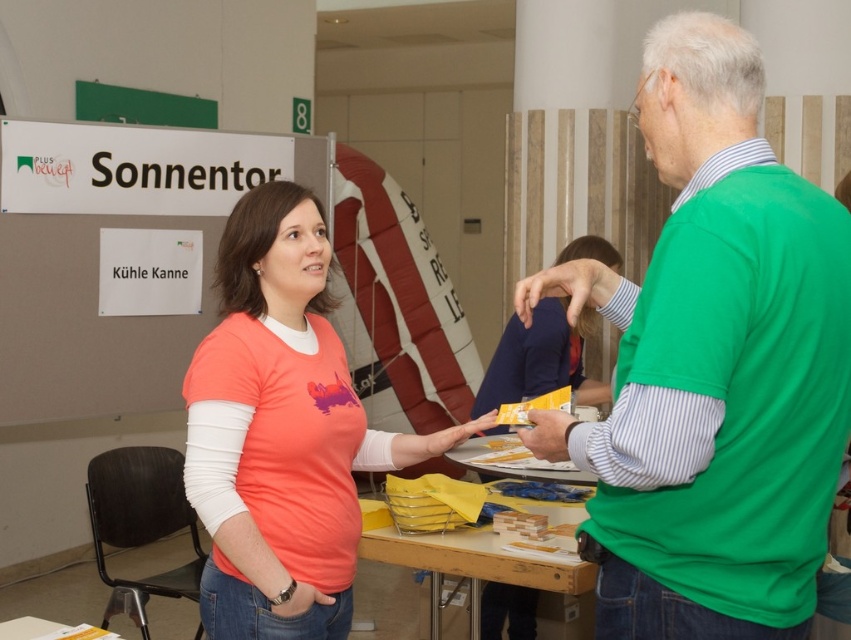
Question: Among these objects, which one is nearest to the camera?

Choices:
 (A) green matte hand at center
 (B) green matte shirt at center
 (C) matte green shirt at center

Answer: (B)

Question: Does matte coral t-shirt at center have a larger size compared to matte yellow plastic spoon at center?

Choices:
 (A) no
 (B) yes

Answer: (B)

Question: Which of the following is the farthest from the observer?

Choices:
 (A) coord(455,442)
 (B) coord(483,618)

Answer: (B)

Question: Is green matte shirt at center thinner than matte coral t-shirt at center?

Choices:
 (A) no
 (B) yes

Answer: (B)

Question: Can you confirm if green matte shirt at center is smaller than matte yellow plastic spoon at center?

Choices:
 (A) no
 (B) yes

Answer: (A)

Question: Which point is farther from the camera taking this photo?

Choices:
 (A) (577, 324)
 (B) (624, 464)
 (C) (330, 417)

Answer: (A)